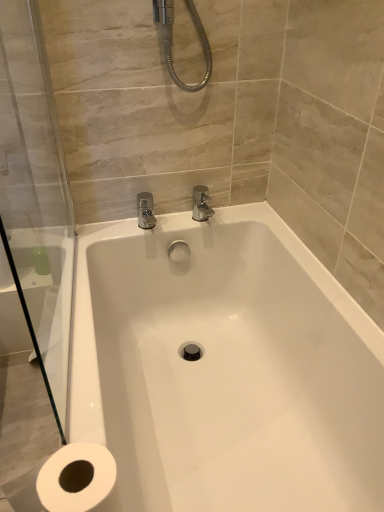
What do you see at coordinates (225, 369) in the screenshot? I see `white glossy bathtub at center` at bounding box center [225, 369].

The height and width of the screenshot is (512, 384). In order to click on white glossy bathtub at center in this screenshot , I will do `click(225, 369)`.

Find the location of a particular element. The image size is (384, 512). transparent glass shower door at left is located at coordinates pyautogui.click(x=35, y=195).

The height and width of the screenshot is (512, 384). Describe the element at coordinates (35, 195) in the screenshot. I see `transparent glass shower door at left` at that location.

What are the coordinates of `white glossy bathtub at center` in the screenshot? It's located at (225, 369).

Which object is positioned more to the right, white glossy bathtub at center or transparent glass shower door at left?

white glossy bathtub at center is more to the right.

Relative to transparent glass shower door at left, is white glossy bathtub at center in front or behind?

Visually, white glossy bathtub at center is located behind transparent glass shower door at left.

Which is closer to the camera, (176, 331) or (44, 354)?

The point (44, 354) is closer.

From the image's perspective, which is below, white glossy bathtub at center or transparent glass shower door at left?

white glossy bathtub at center, from the image's perspective.

From a real-world perspective, does white glossy bathtub at center stand above transparent glass shower door at left?

No, from a real-world perspective, white glossy bathtub at center is not over transparent glass shower door at left

Between white glossy bathtub at center and transparent glass shower door at left, which one has smaller width?

transparent glass shower door at left is thinner.

Can you confirm if white glossy bathtub at center is shorter than transparent glass shower door at left?

Indeed, white glossy bathtub at center has a lesser height compared to transparent glass shower door at left.

Considering the relative sizes of white glossy bathtub at center and transparent glass shower door at left in the image provided, is white glossy bathtub at center bigger than transparent glass shower door at left?

Yes, white glossy bathtub at center is bigger than transparent glass shower door at left.

Does white glossy bathtub at center contain transparent glass shower door at left?

No.

Are white glossy bathtub at center and transparent glass shower door at left located far from each other?

Actually, white glossy bathtub at center and transparent glass shower door at left are a little close together.

Does white glossy bathtub at center turn towards transparent glass shower door at left?

No, white glossy bathtub at center is not aimed at transparent glass shower door at left.

You are a GUI agent. You are given a task and a screenshot of the screen. Output one action in this format:
    pyautogui.click(x=<x>, y=<y>)
    Task: Click on the shower door above the white glossy bathtub at center (from a real-world perspective)
    Image resolution: width=384 pixels, height=512 pixels.
    Given the screenshot: What is the action you would take?
    pyautogui.click(x=35, y=195)

In the scene shown: Which is more to the left, transparent glass shower door at left or white glossy bathtub at center?

transparent glass shower door at left is more to the left.

Which object is closer to the camera taking this photo, transparent glass shower door at left or white glossy bathtub at center?

transparent glass shower door at left is closer to the camera.

Does point (12, 49) come in front of point (232, 413)?

Yes, point (12, 49) is in front of point (232, 413).

From the image's perspective, which one is positioned higher, transparent glass shower door at left or white glossy bathtub at center?

From the image's view, transparent glass shower door at left is above.

From a real-world perspective, between transparent glass shower door at left and white glossy bathtub at center, who is vertically higher?

In real-world perspective, transparent glass shower door at left is above.

Considering the sizes of objects transparent glass shower door at left and white glossy bathtub at center in the image provided, who is thinner, transparent glass shower door at left or white glossy bathtub at center?

With smaller width is transparent glass shower door at left.

Is transparent glass shower door at left taller than white glossy bathtub at center?

Correct, transparent glass shower door at left is much taller as white glossy bathtub at center.

Is transparent glass shower door at left bigger or smaller than white glossy bathtub at center?

Considering their sizes, transparent glass shower door at left takes up less space than white glossy bathtub at center.

Is transparent glass shower door at left inside or outside of white glossy bathtub at center?

transparent glass shower door at left is outside white glossy bathtub at center.

Is transparent glass shower door at left beside white glossy bathtub at center?

No, transparent glass shower door at left is not with white glossy bathtub at center.

Is transparent glass shower door at left oriented towards white glossy bathtub at center?

No, transparent glass shower door at left is not oriented towards white glossy bathtub at center.

How much distance is there between transparent glass shower door at left and white glossy bathtub at center?

transparent glass shower door at left and white glossy bathtub at center are 15.76 inches apart from each other.

Locate an element on the screen. Image resolution: width=384 pixels, height=512 pixels. shower door located in front of the white glossy bathtub at center is located at coordinates (35, 195).

This screenshot has width=384, height=512. Find the location of `shower door in front of the white glossy bathtub at center`. shower door in front of the white glossy bathtub at center is located at coordinates (35, 195).

Where is `bathtub beneath the transparent glass shower door at left (from a real-world perspective)`? This screenshot has height=512, width=384. bathtub beneath the transparent glass shower door at left (from a real-world perspective) is located at coordinates (225, 369).